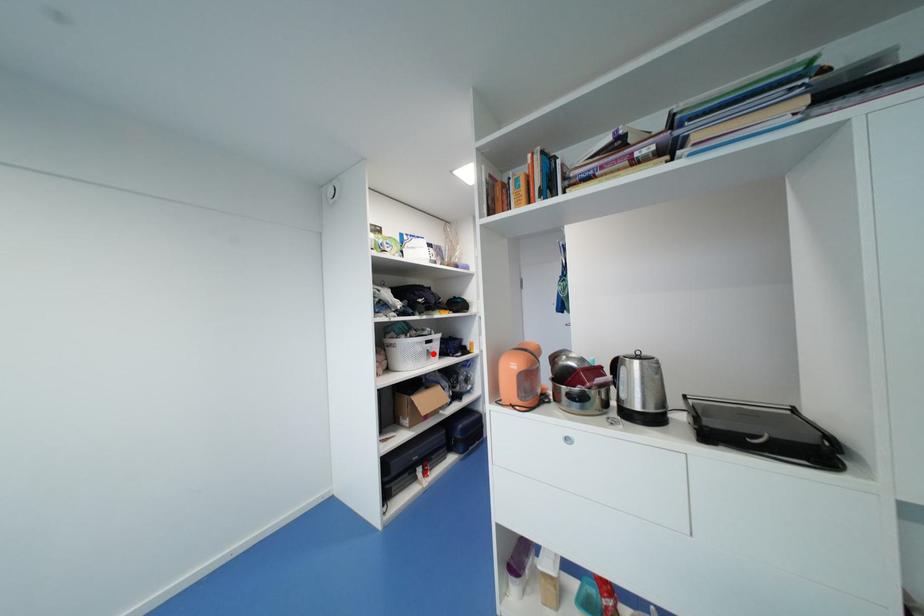
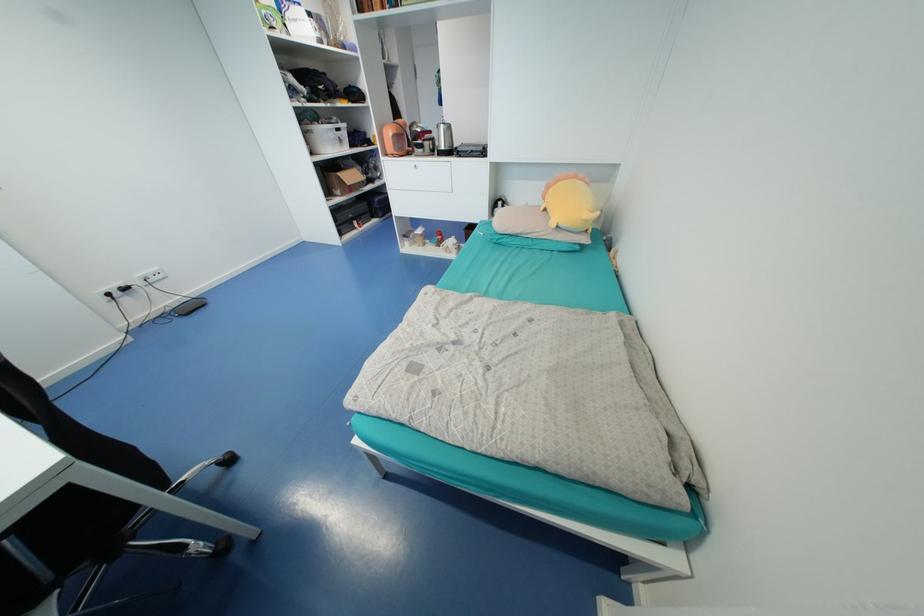
Question: A red point is marked in image1. In image2, is the corresponding 3D point closer to the camera or farther? Reply with the corresponding letter.

Choices:
 (A) The corresponding 3D point is closer.
 (B) The corresponding 3D point is farther.

Answer: (A)